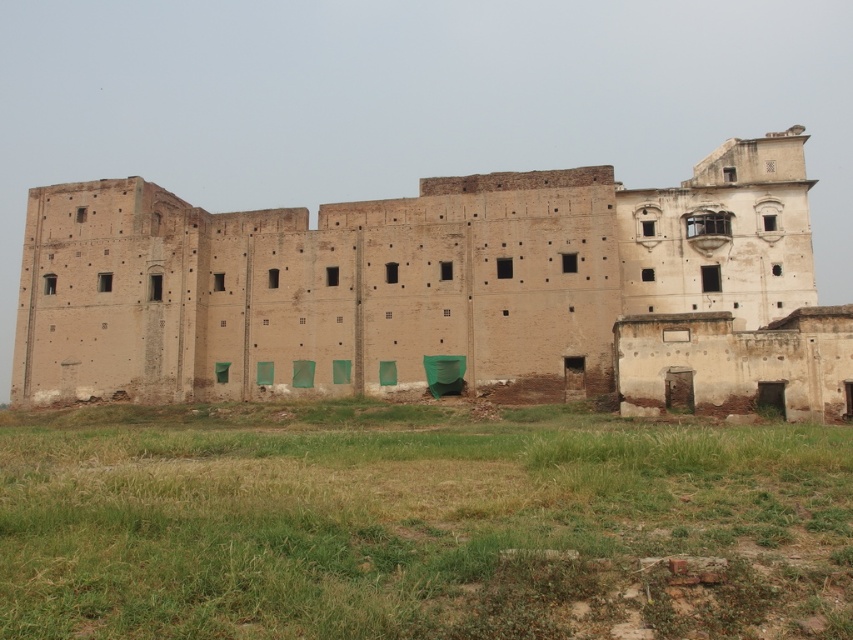
From the picture: You are standing at the entrance of the old building and notice green grass at lower center and beige brick ruins at center. Which object is located to the left when facing the building?

The green grass at lower center is positioned on the left side of beige brick ruins at center, so it is located to the left when facing the building.

You are standing at the entrance of the old building and want to walk to the green grass at lower center. According to the coordinates provided, where should you head relative to your current position?

The green grass at lower center is located at point 0.817 on the x axis and 0.490 on the y axis. Since you are at the entrance, you should head towards the lower center direction to reach it.